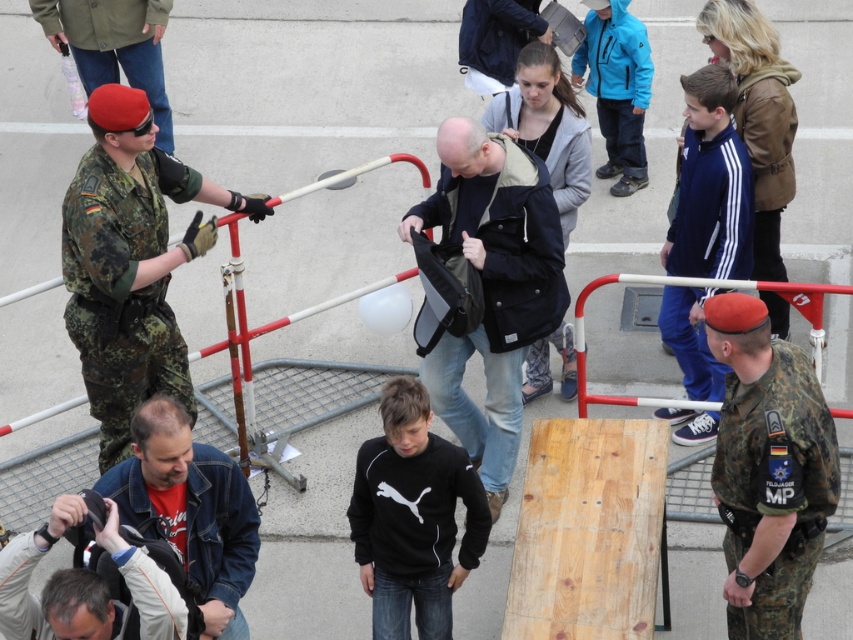
Question: Is camouflage uniform at left bigger than white fabric jacket at lower left?

Choices:
 (A) yes
 (B) no

Answer: (A)

Question: Can you confirm if camouflage fabric uniform at left is positioned below white fabric jacket at lower left?

Choices:
 (A) yes
 (B) no

Answer: (B)

Question: Does blue denim jacket at lower left have a smaller size compared to blue synthetic jacket at upper center?

Choices:
 (A) no
 (B) yes

Answer: (B)

Question: Which point is farther to the camera?

Choices:
 (A) navy blue fabric jacket at center
 (B) blue denim jacket at lower left

Answer: (A)

Question: Estimate the real-world distances between objects in this image. Which object is closer to the blue denim jacket at lower left?

Choices:
 (A) blue synthetic jacket at upper right
 (B) camouflage fabric uniform at right

Answer: (B)

Question: Considering the real-world distances, which object is farthest from the blue synthetic jacket at upper center?

Choices:
 (A) navy blue fabric jacket at center
 (B) blue denim jacket at lower left
 (C) dark blue leather jacket at center

Answer: (B)